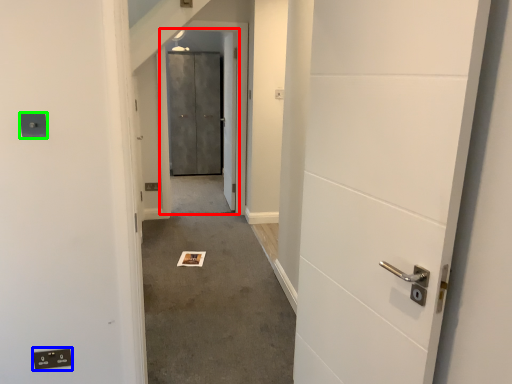
Question: Which object is positioned farthest from elevator door (highlighted by a red box)? Select from electric outlet (highlighted by a blue box) and electric outlet (highlighted by a green box).

Choices:
 (A) electric outlet
 (B) electric outlet

Answer: (A)